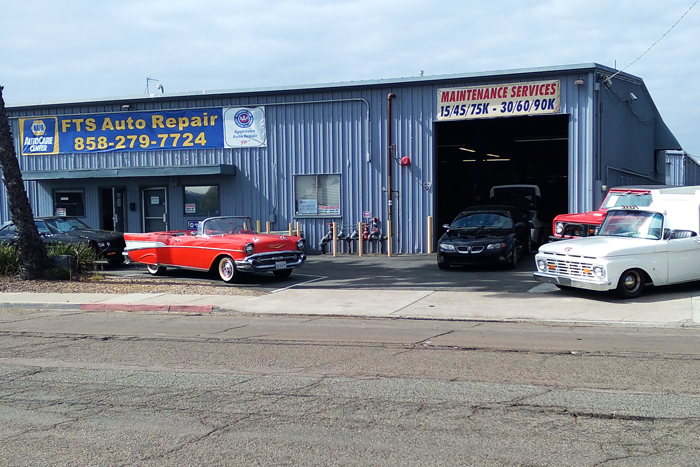
I want to click on door, so click(120, 209).